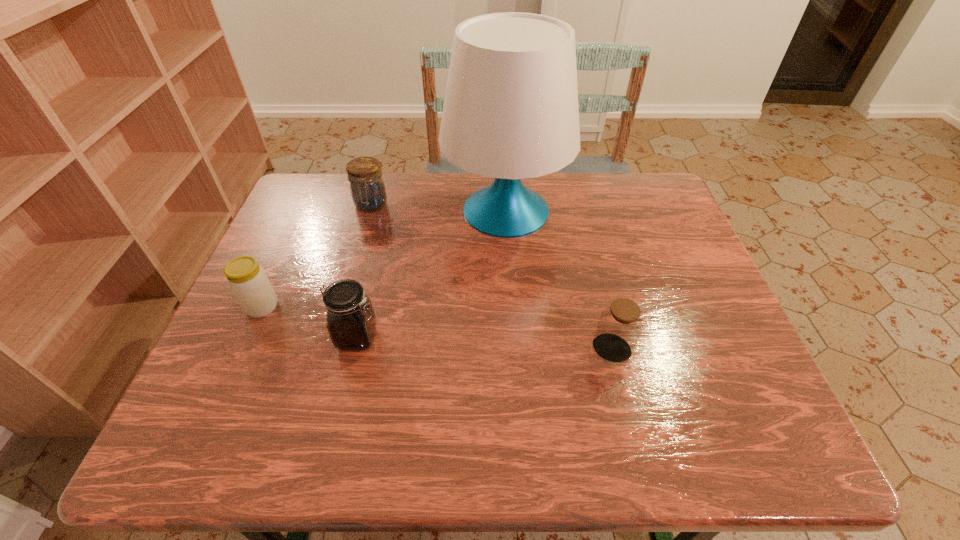
At what (x,y) coordinates should I click in order to perform the action: click on blank space located on the front of the rightmost jar. Please return your answer as a coordinate pair (x, y). This screenshot has width=960, height=540. Looking at the image, I should click on (625, 406).

Locate an element on the screen. This screenshot has height=540, width=960. table lamp that is at the far edge is located at coordinates (510, 112).

The height and width of the screenshot is (540, 960). In order to click on jar that is positioned at the far edge in this screenshot , I will do `click(367, 187)`.

This screenshot has width=960, height=540. I want to click on object that is at the left edge, so click(x=248, y=281).

Where is `free region at the far edge of the desktop`? Image resolution: width=960 pixels, height=540 pixels. free region at the far edge of the desktop is located at coordinates (535, 183).

Where is `free spot at the near edge of the desktop`? free spot at the near edge of the desktop is located at coordinates (292, 426).

In order to click on free space at the left edge of the desktop in this screenshot , I will do `click(302, 239)`.

Where is `vacant space at the right edge of the desktop`? This screenshot has width=960, height=540. vacant space at the right edge of the desktop is located at coordinates (657, 237).

You are a GUI agent. You are given a task and a screenshot of the screen. Output one action in this format:
    pyautogui.click(x=<x>, y=<y>)
    Task: Click on the blank space at the far right corner of the desktop
    Image resolution: width=960 pixels, height=540 pixels.
    Given the screenshot: What is the action you would take?
    pyautogui.click(x=622, y=180)

Identify the location of blank region between the third farthest object and the farthest jar. The image size is (960, 540). (317, 256).